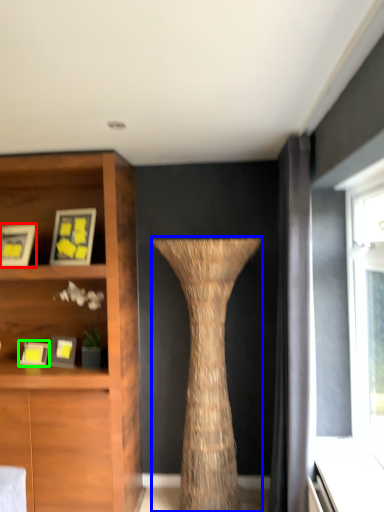
Question: Which object is the farthest from picture frame (highlighted by a red box)? Choose among these: vase (highlighted by a blue box) or picture frame (highlighted by a green box).

Choices:
 (A) vase
 (B) picture frame

Answer: (A)